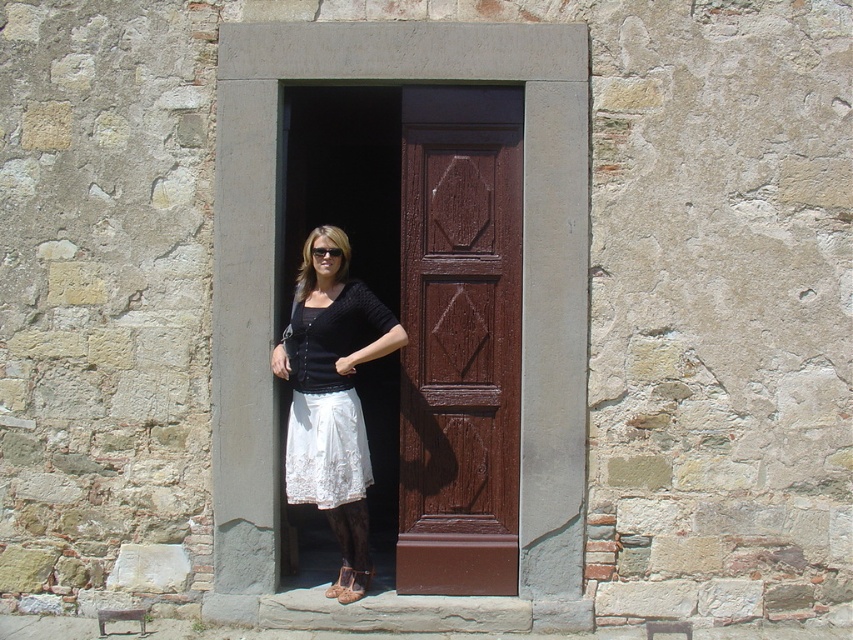
Is white lace skirt at center closer to camera compared to black plastic goggles at center?

That is True.

From the picture: Between white lace skirt at center and black plastic goggles at center, which one is positioned lower?

white lace skirt at center is below.

Is point (341, 378) in front of point (335, 248)?

Yes.

The image size is (853, 640). Find the location of `white lace skirt at center`. white lace skirt at center is located at coordinates tap(332, 397).

Is brown wooden door at center shorter than white lace skirt at center?

No.

Which is in front, point (415, 225) or point (318, 403)?

Point (318, 403)

Does point (428, 131) come farther from viewer compared to point (339, 419)?

Yes, it is.

Where is `brown wooden door at center`? The image size is (853, 640). brown wooden door at center is located at coordinates (459, 340).

Between brown wooden door at center and black plastic goggles at center, which one appears on the right side from the viewer's perspective?

brown wooden door at center

Is brown wooden door at center shorter than black plastic goggles at center?

No, brown wooden door at center is not shorter than black plastic goggles at center.

Which is behind, point (425, 518) or point (341, 252)?

The point (425, 518) is behind.

Locate an element on the screen. brown wooden door at center is located at coordinates (459, 340).